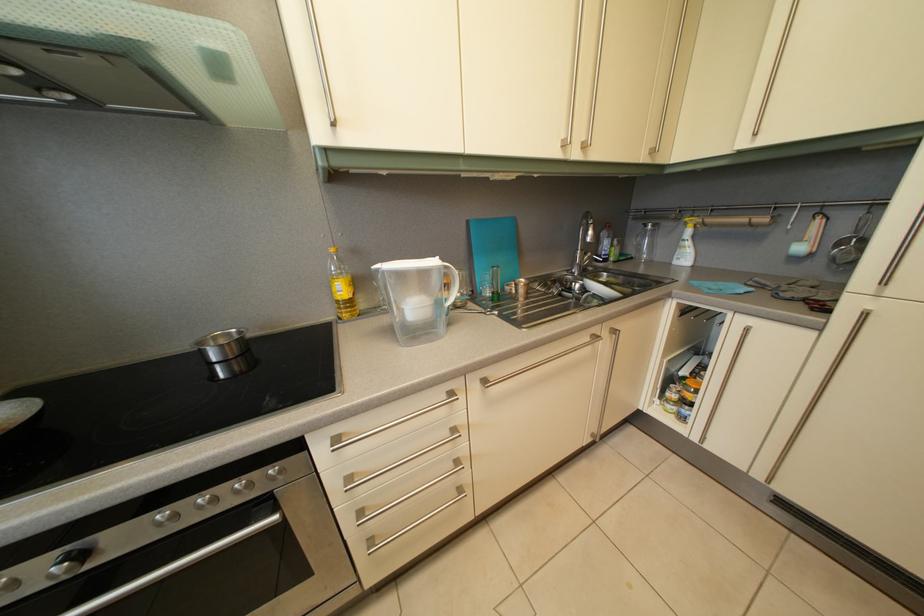
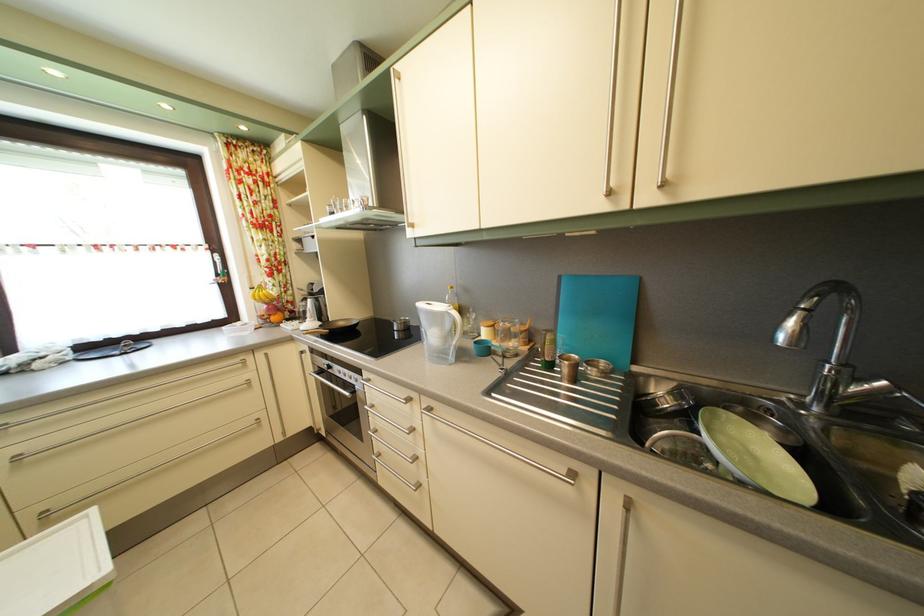
Find the pixel in the second image that matches point 92,562 in the first image.

(337, 374)